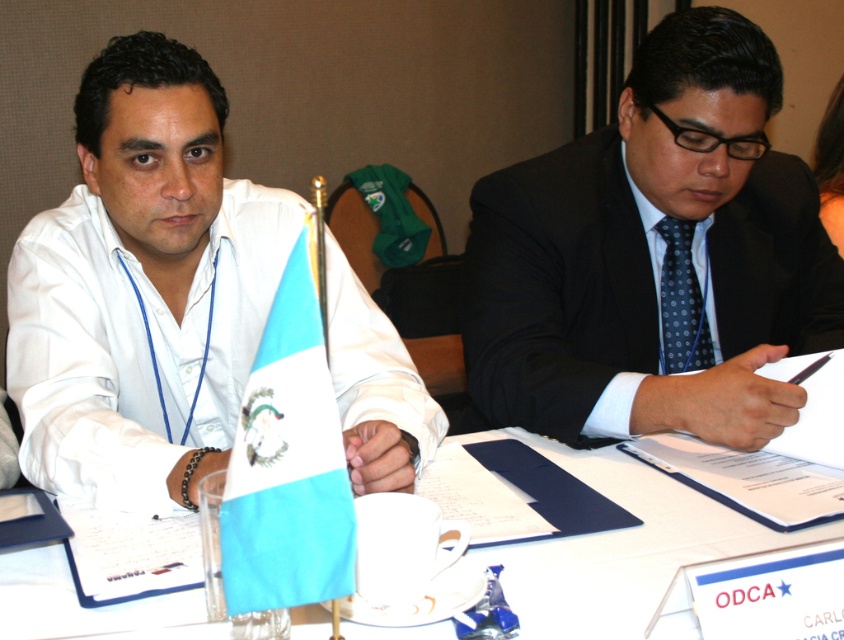
Question: Can you confirm if dark blue suit at center is thinner than white paper at center?

Choices:
 (A) no
 (B) yes

Answer: (B)

Question: Based on their relative distances, which object is farther from the white matte shirt at left?

Choices:
 (A) dark blue suit at center
 (B) blue fabric flag at center
 (C) black hair at upper right

Answer: (C)

Question: Can you confirm if dark blue suit at center is thinner than white paper at center?

Choices:
 (A) yes
 (B) no

Answer: (A)

Question: Can you confirm if white paper at center is bigger than blue dotted tie at center?

Choices:
 (A) no
 (B) yes

Answer: (B)

Question: Which point appears farthest from the camera in this image?

Choices:
 (A) (42, 586)
 (B) (215, 337)

Answer: (B)

Question: Based on their relative distances, which object is nearer to the dark blue suit at center?

Choices:
 (A) white paper at center
 (B) black hair at upper right

Answer: (A)